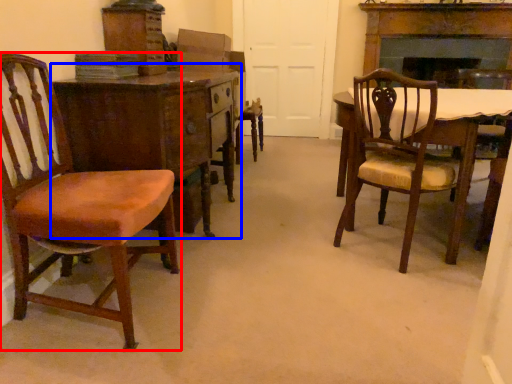
Question: Among these objects, which one is farthest to the camera, chair (highlighted by a red box) or desk (highlighted by a blue box)?

Choices:
 (A) chair
 (B) desk

Answer: (B)